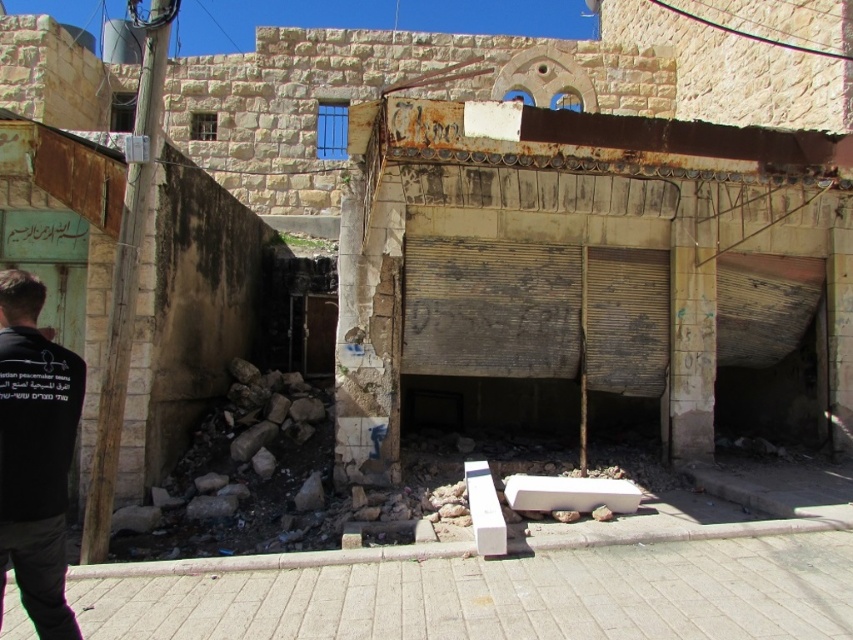
You are standing in front of the weathered stone building and notice two points marked on the ground. The first point is at coordinate point (566, 563) and the second is at point (74, 627). Which point is closer to your current position?

Point (74, 627) is closer to your current position because it is nearer to the camera than point (566, 563).

You are a photographer standing in front of the weathered stone building. You notice a black fabric shirt at left and a white concrete wall at lower center in your viewfinder. Which object is closer to you, the photographer?

The white concrete wall at lower center is closer to you because the black fabric shirt at left is behind it.